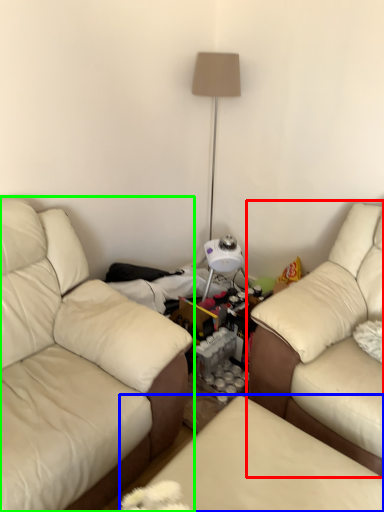
Question: Considering the real-world distances, which object is closest to studio couch (highlighted by a red box)? swivel chair (highlighted by a blue box) or studio couch (highlighted by a green box).

Choices:
 (A) swivel chair
 (B) studio couch

Answer: (A)